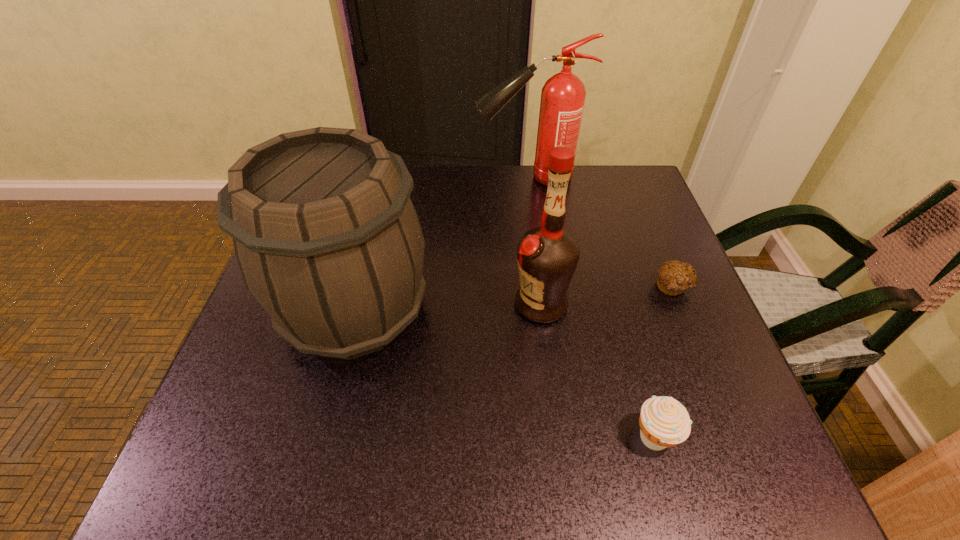
The height and width of the screenshot is (540, 960). Identify the location of vacant area that lies between the wine bucket and the fire extinguisher. (442, 244).

Identify the location of free point between the leftmost object and the left muffin. The width and height of the screenshot is (960, 540). (505, 374).

Where is `vacant point located between the right muffin and the farthest object`? The image size is (960, 540). vacant point located between the right muffin and the farthest object is located at coordinates (601, 232).

This screenshot has height=540, width=960. What are the coordinates of `free space that is in between the wine bucket and the fourth tallest object` in the screenshot? It's located at (505, 374).

Select which object appears as the closest to the farthest object. Please provide its 2D coordinates. Your answer should be formatted as a tuple, i.e. [(x, y)], where the tuple contains the x and y coordinates of a point satisfying the conditions above.

[(327, 239)]

Identify which object is located as the third nearest to the liquor. Please provide its 2D coordinates. Your answer should be formatted as a tuple, i.e. [(x, y)], where the tuple contains the x and y coordinates of a point satisfying the conditions above.

[(664, 422)]

Find the location of a particular element. blank area in the image that satisfies the following two spatial constraints: 1. on the back side of the second shortest object; 2. on the front and back of the liquor is located at coordinates (617, 304).

Locate an element on the screen. The image size is (960, 540). free location that satisfies the following two spatial constraints: 1. at the nozzle end of the farthest object; 2. on the left side of the shortest object is located at coordinates (542, 287).

Find the location of a particular element. The width and height of the screenshot is (960, 540). vacant space that satisfies the following two spatial constraints: 1. on the back side of the left muffin; 2. on the front and back of the liquor is located at coordinates (617, 304).

Identify the location of blank area in the image that satisfies the following two spatial constraints: 1. at the nozzle end of the taller muffin; 2. on the left side of the fire extinguisher. (563, 437).